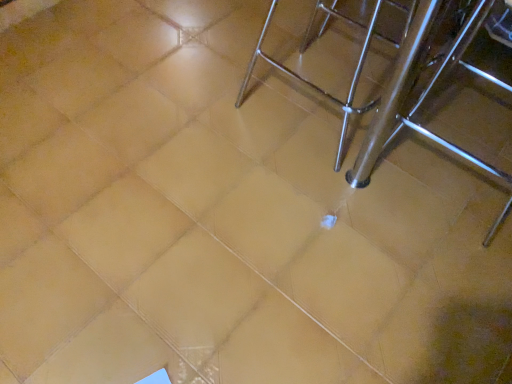
Question: Is polished metal chair at upper right wider than silver metallic stool at center?

Choices:
 (A) yes
 (B) no

Answer: (B)

Question: Is polished metal chair at upper right looking in the opposite direction of silver metallic stool at center?

Choices:
 (A) no
 (B) yes

Answer: (B)

Question: Is polished metal chair at upper right beside silver metallic stool at center?

Choices:
 (A) yes
 (B) no

Answer: (B)

Question: Can you confirm if polished metal chair at upper right is bigger than silver metallic stool at center?

Choices:
 (A) no
 (B) yes

Answer: (A)

Question: Is the position of polished metal chair at upper right less distant than that of silver metallic stool at center?

Choices:
 (A) no
 (B) yes

Answer: (A)

Question: Can you confirm if polished metal chair at upper right is smaller than silver metallic stool at center?

Choices:
 (A) no
 (B) yes

Answer: (B)

Question: Can you confirm if silver metallic stool at center is wider than polished metal chair at upper right?

Choices:
 (A) yes
 (B) no

Answer: (A)

Question: Does silver metallic stool at center have a greater height compared to polished metal chair at upper right?

Choices:
 (A) yes
 (B) no

Answer: (A)

Question: Is silver metallic stool at center at the left side of polished metal chair at upper right?

Choices:
 (A) yes
 (B) no

Answer: (B)

Question: Could you tell me if silver metallic stool at center is facing polished metal chair at upper right?

Choices:
 (A) yes
 (B) no

Answer: (B)

Question: Is silver metallic stool at center next to polished metal chair at upper right?

Choices:
 (A) yes
 (B) no

Answer: (B)

Question: Would you say silver metallic stool at center contains polished metal chair at upper right?

Choices:
 (A) yes
 (B) no

Answer: (A)

Question: Considering their positions, is silver metallic stool at center located in front of or behind polished metal chair at upper right?

Choices:
 (A) front
 (B) behind

Answer: (A)